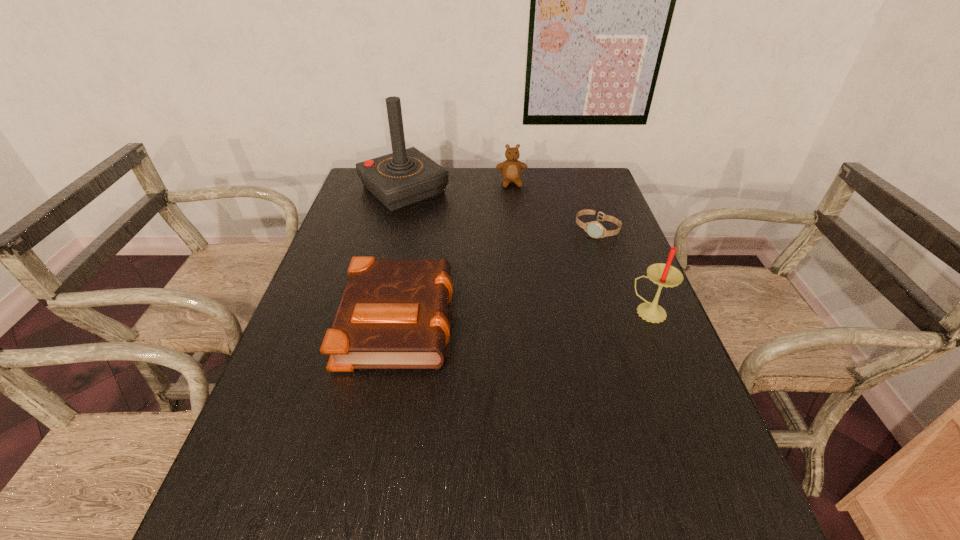
You are a GUI agent. You are given a task and a screenshot of the screen. Output one action in this format:
    pyautogui.click(x=<x>, y=<y>)
    Task: Click on the Bible that is at the left edge
    The width and height of the screenshot is (960, 540).
    Given the screenshot: What is the action you would take?
    pyautogui.click(x=393, y=313)

Locate an element on the screen. The width and height of the screenshot is (960, 540). joystick present at the left edge is located at coordinates (405, 177).

The image size is (960, 540). In order to click on candle located at the right edge in this screenshot , I will do `click(665, 275)`.

I want to click on watch located at the right edge, so click(x=594, y=229).

Image resolution: width=960 pixels, height=540 pixels. In order to click on object that is positioned at the far left corner in this screenshot , I will do click(x=405, y=177).

Image resolution: width=960 pixels, height=540 pixels. In the image, there is a desktop. In order to click on free region at the far edge in this screenshot , I will do `click(518, 195)`.

The height and width of the screenshot is (540, 960). In order to click on vacant area at the near edge of the desktop in this screenshot , I will do `click(354, 462)`.

At what (x,y) coordinates should I click in order to perform the action: click on blank space at the right edge of the desktop. Please return your answer as a coordinate pair (x, y). Image resolution: width=960 pixels, height=540 pixels. Looking at the image, I should click on (633, 422).

The width and height of the screenshot is (960, 540). What are the coordinates of `free spot at the near left corner of the desktop` in the screenshot? It's located at (255, 448).

The height and width of the screenshot is (540, 960). Find the location of `free point at the far right corner`. free point at the far right corner is located at coordinates (580, 174).